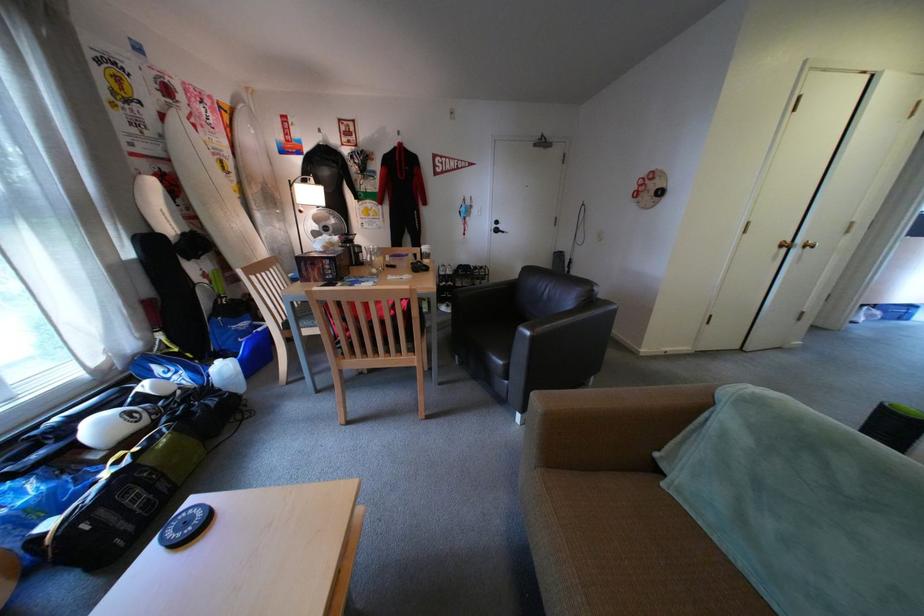
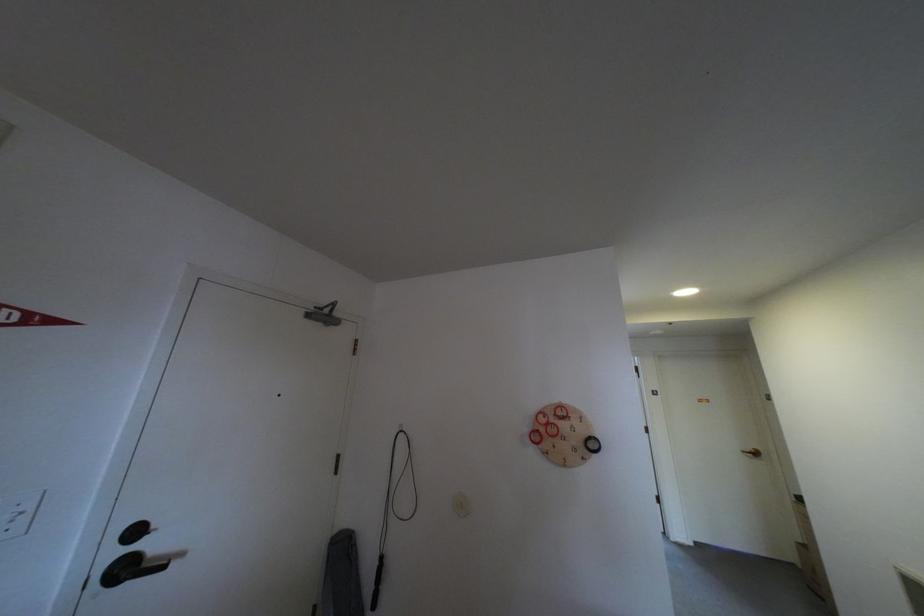
In the second image, find the point that corresponds to [511,232] in the first image.

(140, 570)